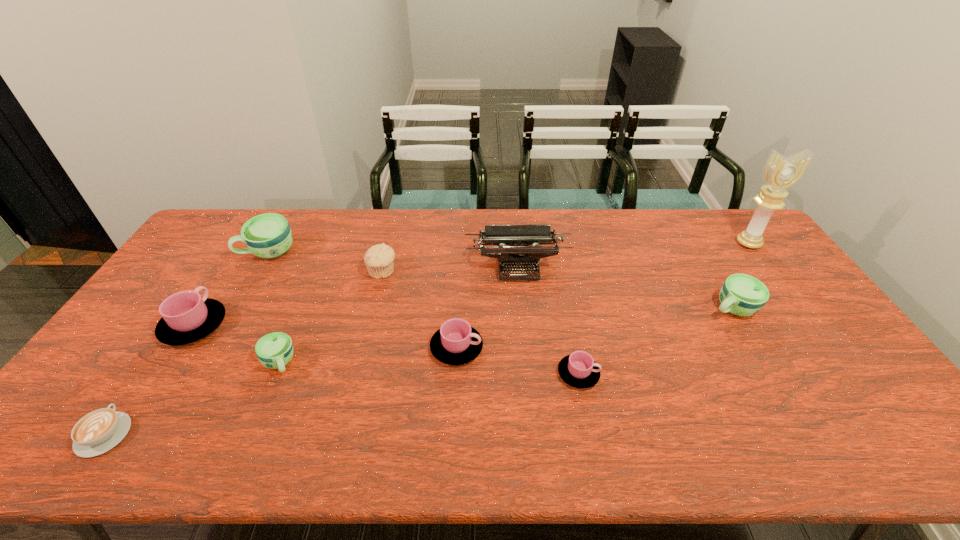
At what (x,y) coordinates should I click in order to perform the action: click on free location located on the front of the tallest cup. Please return your answer as a coordinate pair (x, y). Looking at the image, I should click on (250, 287).

Find the location of `vacant space situated on the left of the beige muffin`. vacant space situated on the left of the beige muffin is located at coordinates (266, 272).

I want to click on blank space located on the right of the ninth object from left to right, so click(x=776, y=308).

Image resolution: width=960 pixels, height=540 pixels. In order to click on vacant space located on the side with the handle of the biggest pink cup in this screenshot , I will do `click(252, 236)`.

Locate an element on the screen. The width and height of the screenshot is (960, 540). vacant region located on the side with the handle of the biggest pink cup is located at coordinates (217, 289).

You are a GUI agent. You are given a task and a screenshot of the screen. Output one action in this format:
    pyautogui.click(x=<x>, y=<y>)
    Task: Click on the free space located 0.340m on the side with the handle of the biggest pink cup
    Image resolution: width=960 pixels, height=540 pixels.
    Given the screenshot: What is the action you would take?
    pyautogui.click(x=252, y=236)

Locate an element on the screen. vacant space located 0.070m on the side with the handle of the third cup from right to left is located at coordinates (509, 348).

Identify the location of free spot located on the left of the smallest blue cup. Image resolution: width=960 pixels, height=540 pixels. (130, 363).

Where is `vacant space situated on the side with the handle of the second shortest object`? This screenshot has width=960, height=540. vacant space situated on the side with the handle of the second shortest object is located at coordinates (696, 374).

This screenshot has height=540, width=960. I want to click on vacant region located 0.400m on the side of the shortest object with the handle, so click(199, 295).